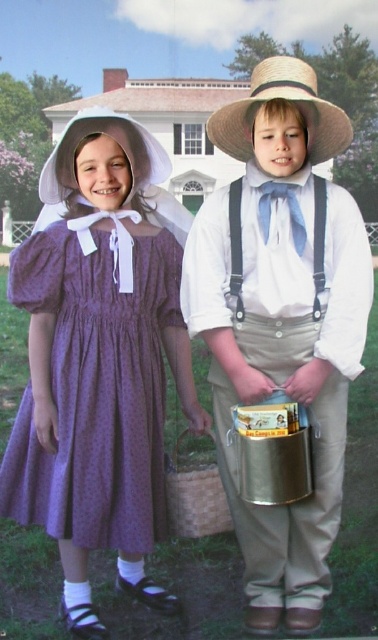
Question: Which is nearer to the purple dotted fabric dress at left?

Choices:
 (A) straw hat at upper center
 (B) woven straw basket at center
 (C) matte straw hat at center

Answer: (B)

Question: Can you confirm if purple dotted fabric dress at left is positioned below woven straw basket at center?

Choices:
 (A) no
 (B) yes

Answer: (A)

Question: Does straw hat at upper center appear over woven straw basket at center?

Choices:
 (A) no
 (B) yes

Answer: (B)

Question: Does straw hat at upper center appear under woven straw basket at center?

Choices:
 (A) no
 (B) yes

Answer: (A)

Question: Which object is positioned closest to the purple dotted fabric dress at left?

Choices:
 (A) straw hat at upper center
 (B) matte straw hat at center
 (C) strawhat at right

Answer: (B)

Question: Estimate the real-world distances between objects in this image. Which object is farther from the strawhat at right?

Choices:
 (A) matte straw hat at center
 (B) woven straw basket at center
 (C) purple dotted fabric dress at left

Answer: (B)